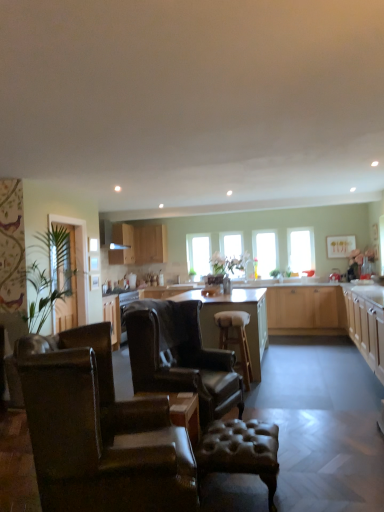
Question: From the image's perspective, relative to light wood cabinet at upper center, which is the 1th cabinetry from left to right, is transparent glass window at center, the second window when ordered from right to left, above or below?

Choices:
 (A) above
 (B) below

Answer: (B)

Question: In terms of size, does transparent glass window at center, the third window from the left, appear bigger or smaller than light wood cabinet at upper center, which is the first cabinetry in back-to-front order?

Choices:
 (A) big
 (B) small

Answer: (B)

Question: Which object is the closest to the transparent glass window at center, the third window from the left?

Choices:
 (A) light wood cabinet at upper center, which ranks as the 2th cabinetry in left-to-right order
 (B) clear glass window at center, which is the fourth window in right-to-left order
 (C) leather stool at center
 (D) light wood cabinet at upper center, marked as the third cabinetry in a front-to-back arrangement
 (E) clear glass window at center, which is the 2th window from left to right

Answer: (E)

Question: Which is farther from the clear glass window at center, which is the third window in right-to-left order?

Choices:
 (A) light wood cabinet at upper center, which is the 1th cabinetry from left to right
 (B) white leather bar stool at center, the 2th bar stool in the front-to-back sequence
 (C) leather stool at center
 (D) leather tufted bar stool at center, the 1th bar stool positioned from the front
 (E) light brown wood countertop at center

Answer: (D)